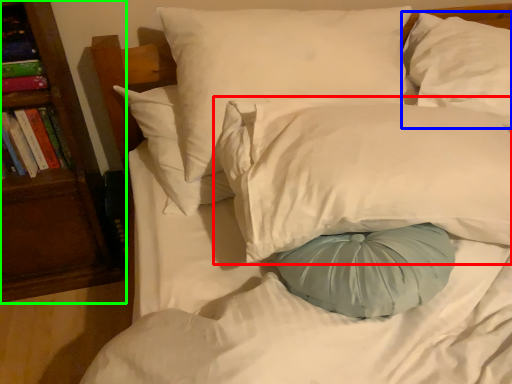
Question: Which object is positioned farthest from pillow (highlighted by a red box)? Select from pillow (highlighted by a blue box) and bookshelf (highlighted by a green box).

Choices:
 (A) pillow
 (B) bookshelf

Answer: (B)